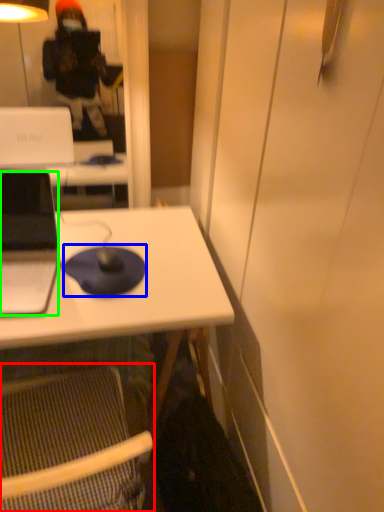
Question: Which is nearer to the folding chair (highlighted by a red box)? mousepad (highlighted by a blue box) or laptop (highlighted by a green box).

Choices:
 (A) mousepad
 (B) laptop

Answer: (A)